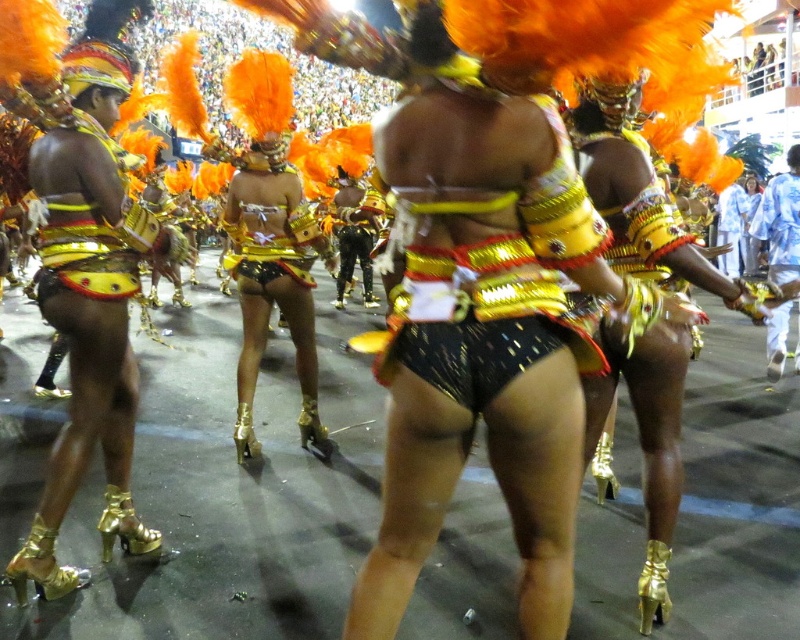
Question: Is blue fabric pants at right thinner than shiny black pants at center?

Choices:
 (A) no
 (B) yes

Answer: (A)

Question: Which object is closer to the camera taking this photo?

Choices:
 (A) blue fabric pants at right
 (B) shiny black pants at center
 (C) shiny gold shorts at center
 (D) blue cotton shirt at right

Answer: (C)

Question: Which of these objects is positioned farthest from the shiny black pants at center?

Choices:
 (A) blue fabric pants at right
 (B) blue cotton shirt at right
 (C) shiny gold shorts at center

Answer: (C)

Question: Among these objects, which one is nearest to the camera?

Choices:
 (A) blue fabric pants at right
 (B) shiny gold shorts at center
 (C) blue cotton shirt at right
 (D) shiny black pants at center

Answer: (B)

Question: Is shiny gold shorts at center below blue fabric pants at right?

Choices:
 (A) yes
 (B) no

Answer: (A)

Question: Does blue fabric pants at right appear under shiny black pants at center?

Choices:
 (A) no
 (B) yes

Answer: (B)